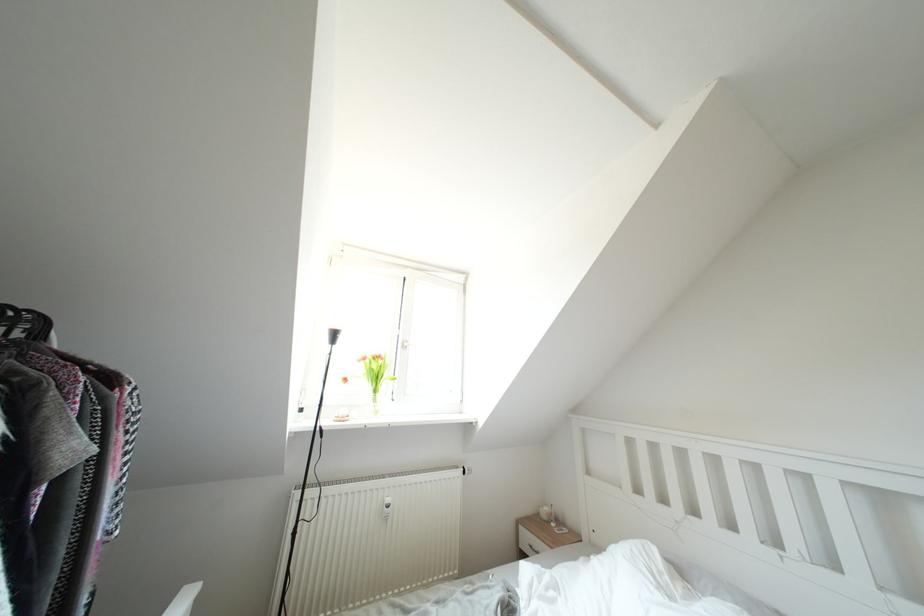
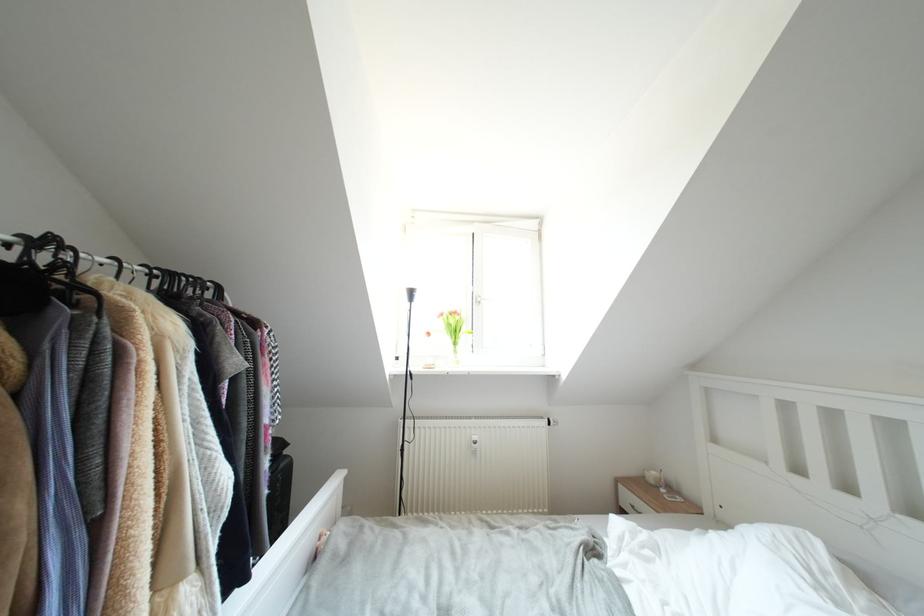
From the picture: Which direction would the cameraman need to move to produce the second image?

The cameraman walked toward right, forward.